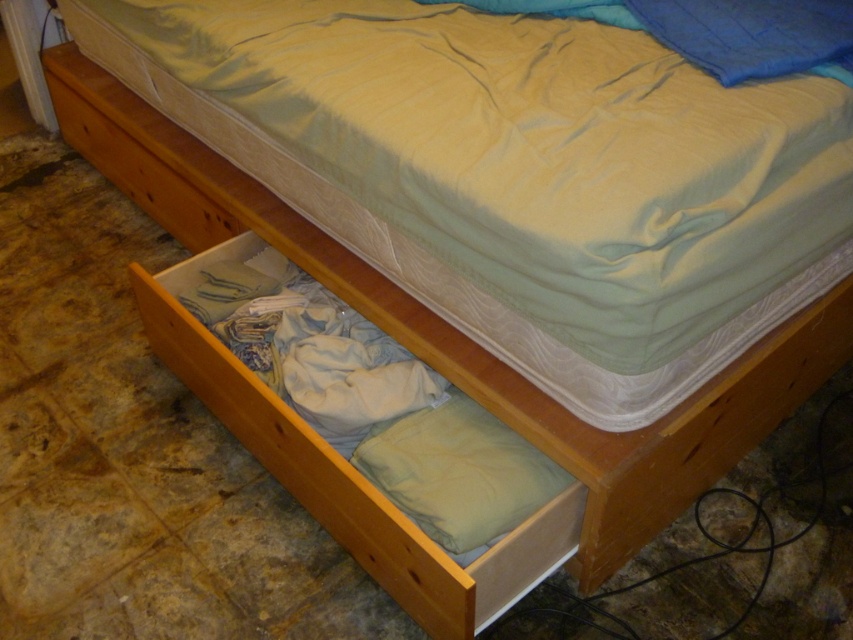
You are standing in the bedroom and want to reach the light brown wood drawer at lower center. However, there is a soft green fabric mattress at center in your way. Can you easily access the drawer without moving the mattress?

The soft green fabric mattress at center is closer to the viewer than the light brown wood drawer at lower center, so you cannot easily access the drawer without moving the mattress because it is blocked by the mattress.

You are standing at the foot of the bed and want to access the light brown wood drawer at lower left. Based on its coordinates, is it located to your left or right side?

The light brown wood drawer at lower left is located at coordinates point (347, 474). Since it is at lower left, it is to your left side.

What are the coordinates of the soft green fabric mattress at center?

The coordinates of the soft green fabric mattress at center are at point (518, 173).